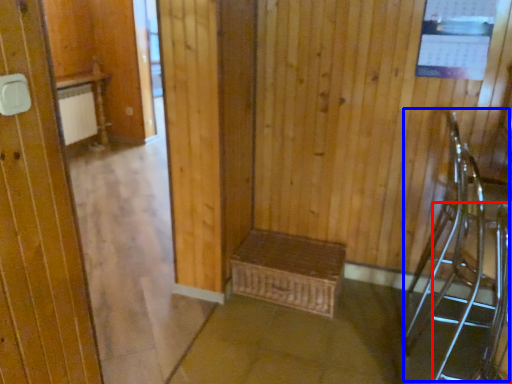
Question: Which point is further to the camera, armchair (highlighted by a red box) or armchair (highlighted by a blue box)?

Choices:
 (A) armchair
 (B) armchair

Answer: (B)